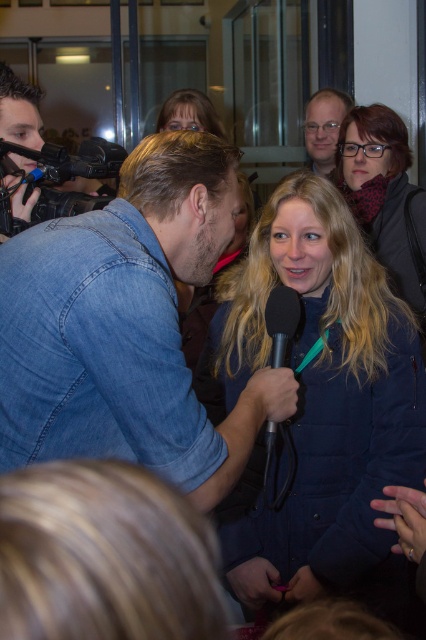
Question: Can you confirm if denim jacket at center is positioned to the left of black matte microphone at center?

Choices:
 (A) no
 (B) yes

Answer: (B)

Question: Observing the image, what is the correct spatial positioning of matte black jacket at upper right in reference to matte blue shirt at upper center?

Choices:
 (A) below
 (B) above

Answer: (A)

Question: Observing the image, what is the correct spatial positioning of black plastic video camera at upper left in reference to matte blue shirt at upper center?

Choices:
 (A) left
 (B) right

Answer: (A)

Question: Which point is farther from the camera taking this photo?

Choices:
 (A) (192, 189)
 (B) (313, 144)
 (C) (273, 275)
 (D) (83, 144)

Answer: (B)

Question: Which point is farther from the camera taking this photo?

Choices:
 (A) (268, 436)
 (B) (66, 189)
 (C) (322, 122)
 (D) (327, 552)

Answer: (C)

Question: Which is nearer to the denim jacket at center?

Choices:
 (A) black plastic video camera at upper left
 (B) matte black jacket at upper right

Answer: (A)